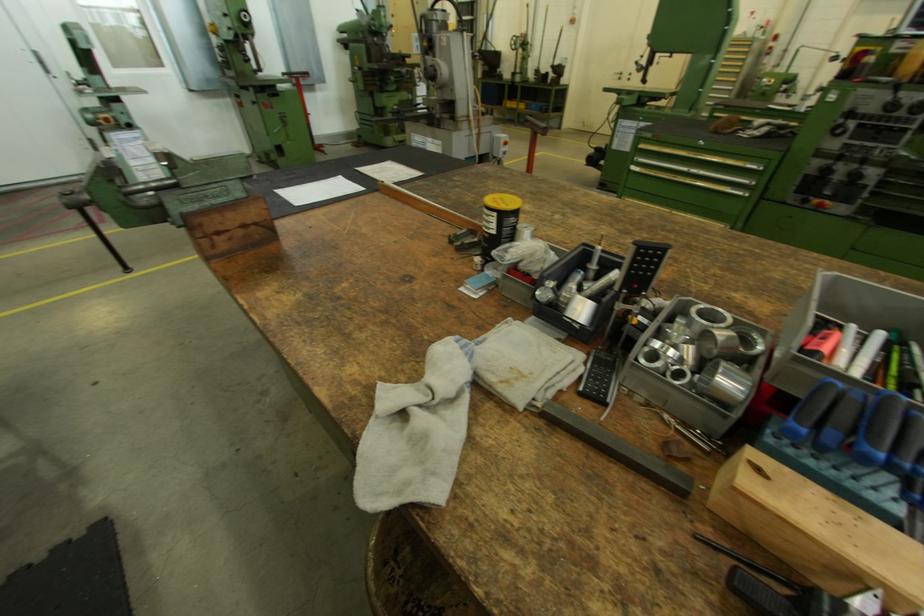
Describe the element at coordinates (641, 65) in the screenshot. Image resolution: width=924 pixels, height=616 pixels. I see `the black control knob` at that location.